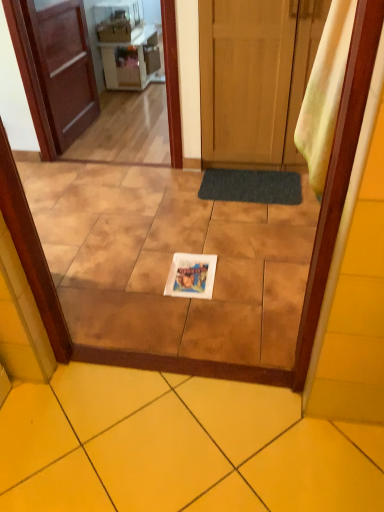
The width and height of the screenshot is (384, 512). In order to click on empty space that is ontop of dark gray textured bath mat at center (from a real-world perspective) in this screenshot , I will do `click(251, 181)`.